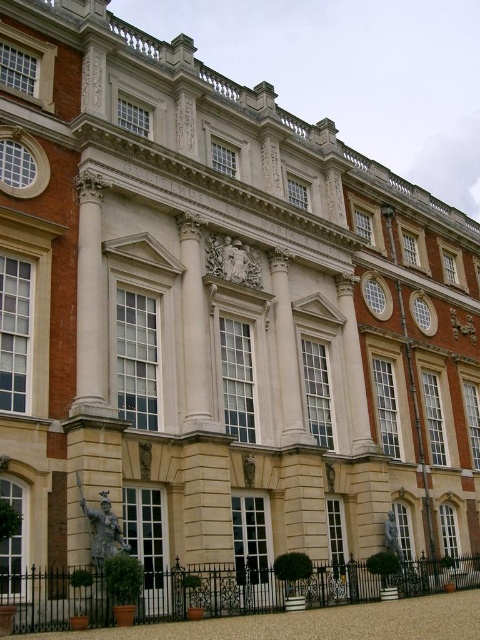
Is point (107, 545) farther from camera compared to point (392, 515)?

No, (107, 545) is closer to viewer.

Does bronze statue at center appear over bronze statue at lower center?

Indeed, bronze statue at center is positioned over bronze statue at lower center.

Between point (104, 540) and point (384, 545), which one is positioned behind?

The point (384, 545) is more distant.

The image size is (480, 640). What are the coordinates of `bronze statue at center` in the screenshot? It's located at (103, 529).